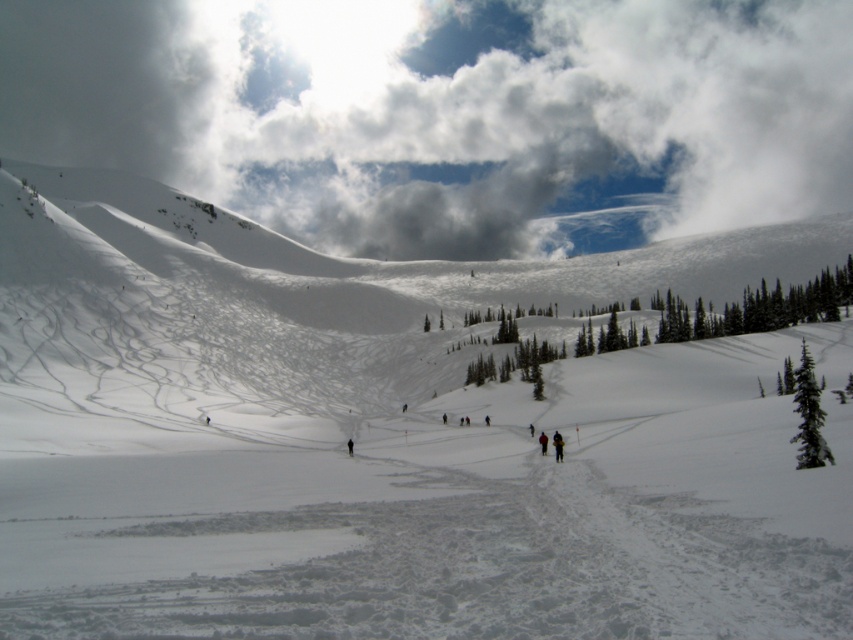
Question: Does yellow jacket at center have a larger size compared to black fabric person at center?

Choices:
 (A) yes
 (B) no

Answer: (A)

Question: Which object is positioned closest to the black fabric person at center?

Choices:
 (A) black fabric person at lower right
 (B) cloudy sky at upper center
 (C) yellow jacket at center

Answer: (C)

Question: Does black fabric person at lower right have a smaller size compared to yellow jacket at center?

Choices:
 (A) no
 (B) yes

Answer: (A)

Question: Considering the relative positions of cloudy sky at upper center and yellow jacket at center in the image provided, where is cloudy sky at upper center located with respect to yellow jacket at center?

Choices:
 (A) right
 (B) left

Answer: (B)

Question: Which of the following is the closest to the observer?

Choices:
 (A) black fabric person at lower right
 (B) black fabric person at center
 (C) cloudy sky at upper center
 (D) yellow jacket at center

Answer: (A)

Question: Which of the following is the farthest from the observer?

Choices:
 (A) yellow jacket at center
 (B) black fabric person at lower right
 (C) black fabric person at center

Answer: (C)